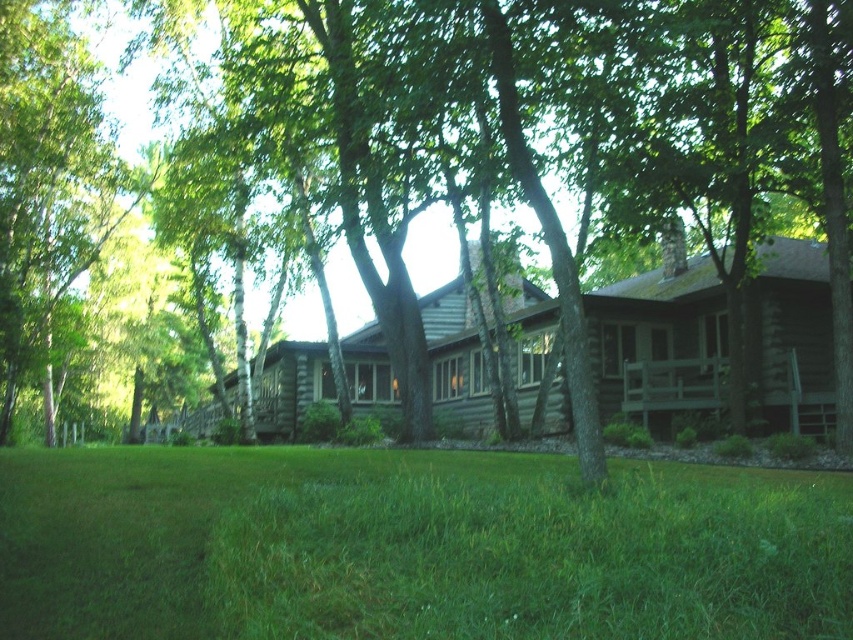
Question: Which point is closer to the camera taking this photo?

Choices:
 (A) (173, 614)
 (B) (763, 316)

Answer: (A)

Question: Is green grass at lower center bigger than brown/log cabin at center?

Choices:
 (A) yes
 (B) no

Answer: (B)

Question: Which of the following is the closest to the observer?

Choices:
 (A) (653, 340)
 (B) (622, 513)

Answer: (B)

Question: Can you confirm if green grass at lower center is positioned above brown/log cabin at center?

Choices:
 (A) yes
 (B) no

Answer: (B)

Question: Is green grass at lower center above brown/log cabin at center?

Choices:
 (A) yes
 (B) no

Answer: (B)